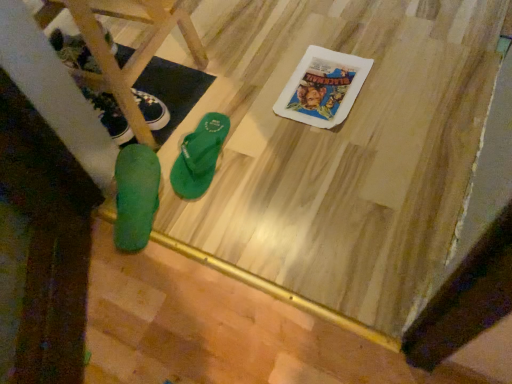
Question: In terms of height, does matte black sneaker at left, the 1th footwear when ordered from left to right, look taller or shorter compared to green rubber flip-flop at lower left, acting as the 2th footwear starting from the right?

Choices:
 (A) tall
 (B) short

Answer: (B)

Question: From a real-world perspective, is matte black sneaker at left, marked as the third footwear in a right-to-left arrangement, physically located above or below green rubber flip-flop at lower left, which is the 2th footwear from left to right?

Choices:
 (A) above
 (B) below

Answer: (B)

Question: Estimate the real-world distances between objects in this image. Which object is farther from the matte black sneaker at left, marked as the third footwear in a right-to-left arrangement?

Choices:
 (A) green rubber flip-flop at lower left, which is the 2th footwear from left to right
 (B) green rubber flip-flops at lower left
 (C) green rubber flip-flop at center, which appears as the 1th footwear when viewed from the right

Answer: (C)

Question: Which object is positioned farthest from the green rubber flip-flop at lower left, which is the 2th footwear from left to right?

Choices:
 (A) green rubber flip-flops at lower left
 (B) green rubber flip-flop at center, the third footwear positioned from the left
 (C) matte black sneaker at left, the 1th footwear when ordered from left to right

Answer: (A)